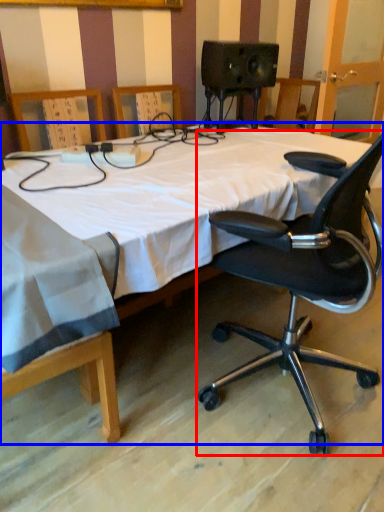
Question: Which point is closer to the camera, chair (highlighted by a red box) or bed (highlighted by a blue box)?

Choices:
 (A) chair
 (B) bed

Answer: (B)